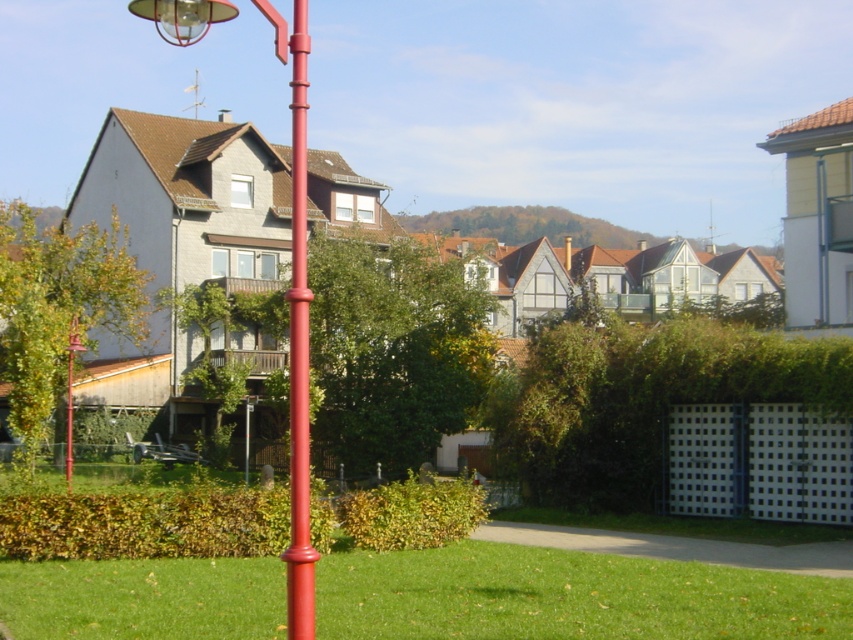
In the scene shown: You are a painter standing at the edge of the grassy area and want to paint both the metallic red pole at center and the smooth glossy red pole at center. Since you only have a 6 foot long easel, can you set it up between them to capture both poles in your painting?

The metallic red pole at center is 5.50 feet away from the smooth glossy red pole at center. Since the distance between them is less than 6 feet, the easel can be placed between them to include both poles in the painting.

You are standing at the red lamppost on the left side of the frame and want to walk to the point marked at coordinates point (292,385) and then to point (312,566). Which point will you reach first?

You will reach point (292,385) first because it is closer to the viewer than point (312,566).